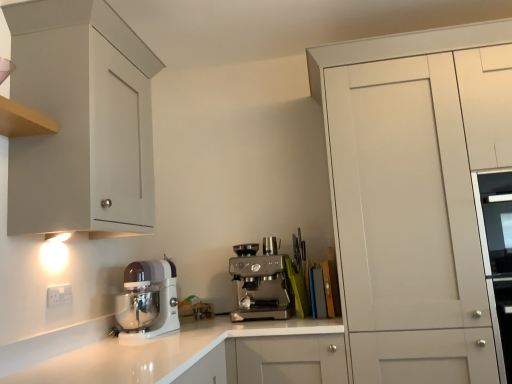
Question: Is satin silver espresso machine at center, which ranks as the second kitchen appliance in left-to-right order, to the right of white glossy countertop at center from the viewer's perspective?

Choices:
 (A) no
 (B) yes

Answer: (B)

Question: Can you confirm if satin silver espresso machine at center, which ranks as the second kitchen appliance in left-to-right order, is positioned to the left of white glossy countertop at center?

Choices:
 (A) yes
 (B) no

Answer: (B)

Question: Is satin silver espresso machine at center, marked as the 1th kitchen appliance in a right-to-left arrangement, facing towards white glossy countertop at center?

Choices:
 (A) yes
 (B) no

Answer: (B)

Question: Is satin silver espresso machine at center, which ranks as the second kitchen appliance in left-to-right order, not close to white glossy countertop at center?

Choices:
 (A) no
 (B) yes

Answer: (A)

Question: From a real-world perspective, is satin silver espresso machine at center, which ranks as the second kitchen appliance in left-to-right order, positioned under white glossy countertop at center based on gravity?

Choices:
 (A) yes
 (B) no

Answer: (B)

Question: Is satin silver espresso machine at center, marked as the 1th kitchen appliance in a right-to-left arrangement, next to white glossy countertop at center and touching it?

Choices:
 (A) yes
 (B) no

Answer: (B)

Question: From the image's perspective, is white matte cabinet at right, the second cabinetry from the left, under white glossy countertop at center?

Choices:
 (A) yes
 (B) no

Answer: (B)

Question: From the image's perspective, is white matte cabinet at right, the second cabinetry from the left, located above white glossy countertop at center?

Choices:
 (A) yes
 (B) no

Answer: (A)

Question: From a real-world perspective, is white matte cabinet at right, the first cabinetry in the right-to-left sequence, below white glossy countertop at center?

Choices:
 (A) yes
 (B) no

Answer: (B)

Question: Considering the relative sizes of white matte cabinet at right, the second cabinetry from the left, and white glossy countertop at center in the image provided, is white matte cabinet at right, the second cabinetry from the left, wider than white glossy countertop at center?

Choices:
 (A) yes
 (B) no

Answer: (A)

Question: Considering the relative positions of white matte cabinet at right, the second cabinetry from the left, and white glossy countertop at center in the image provided, is white matte cabinet at right, the second cabinetry from the left, to the left of white glossy countertop at center from the viewer's perspective?

Choices:
 (A) yes
 (B) no

Answer: (B)

Question: Is white matte cabinet at right, the second cabinetry from the left, bigger than white glossy countertop at center?

Choices:
 (A) no
 (B) yes

Answer: (B)

Question: Is white plastic electric outlet at lower left surrounded by white matte cabinet at right, the first cabinetry in the right-to-left sequence?

Choices:
 (A) no
 (B) yes

Answer: (A)